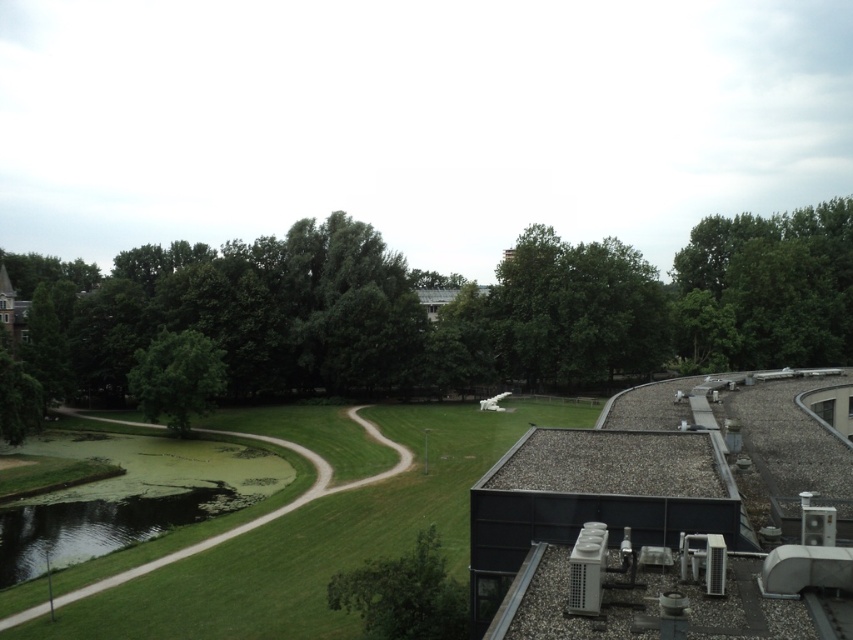
Question: Which point is farther to the camera?

Choices:
 (A) green leafy tree at lower center
 (B) green mossy pond at lower left

Answer: (B)

Question: Considering the real-world distances, which object is closest to the green leafy tree at lower center?

Choices:
 (A) green grass at center
 (B) green leafy tree at center
 (C) green leafy tree at upper right

Answer: (A)

Question: Among these objects, which one is nearest to the camera?

Choices:
 (A) green mossy pond at lower left
 (B) green leafy tree at upper right
 (C) green leafy tree at center

Answer: (A)

Question: Can you confirm if green leafy tree at center is bigger than green leafy tree at lower center?

Choices:
 (A) yes
 (B) no

Answer: (A)

Question: Is green grass at center wider than green leafy tree at upper right?

Choices:
 (A) no
 (B) yes

Answer: (B)

Question: Does green leafy tree at upper right appear over green mossy pond at lower left?

Choices:
 (A) yes
 (B) no

Answer: (A)